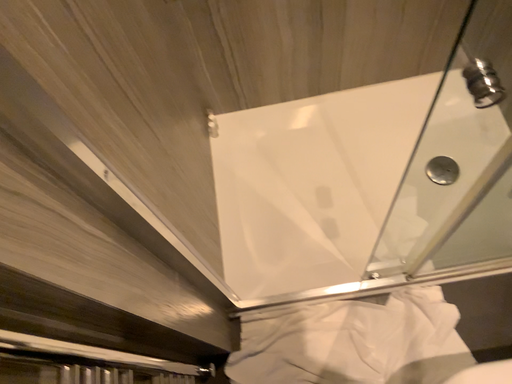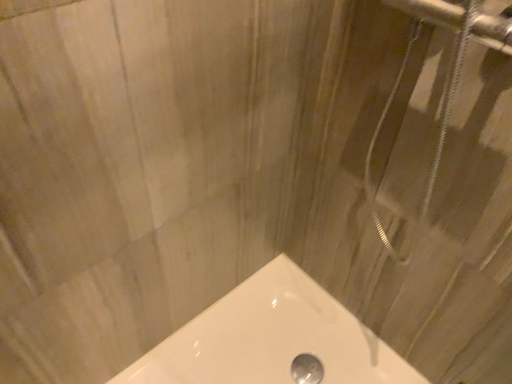
Question: How did the camera likely rotate when shooting the video?

Choices:
 (A) rotated upward
 (B) rotated downward

Answer: (A)